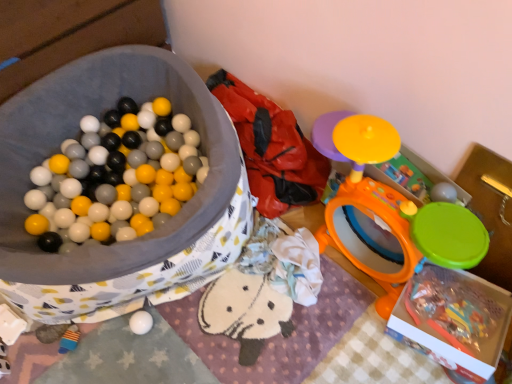
Find the location of a particular element. The image size is (512, 384). vacant area that is in front of smooth plastic toy at lower left, which ranks as the first toy in bottom-to-top order is located at coordinates (64, 369).